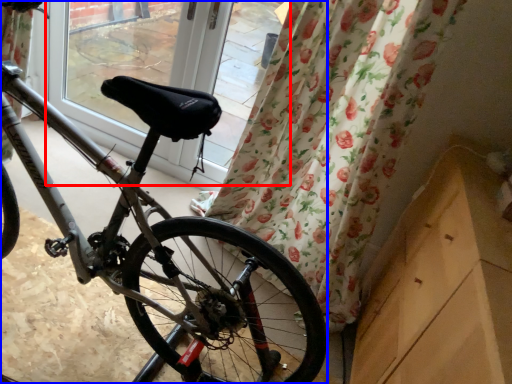
Question: Which point is closer to the camera, window screen (highlighted by a red box) or bicycle (highlighted by a blue box)?

Choices:
 (A) window screen
 (B) bicycle

Answer: (B)